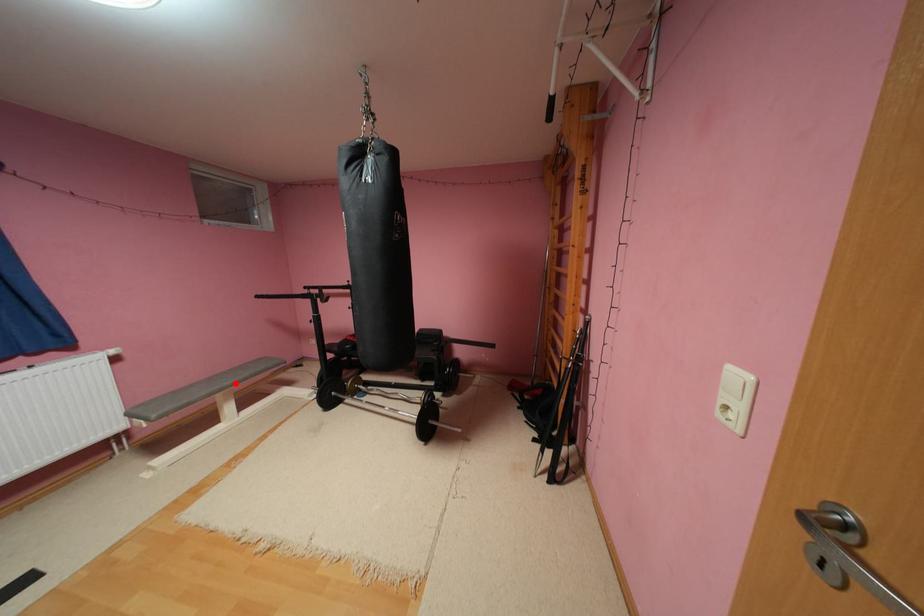
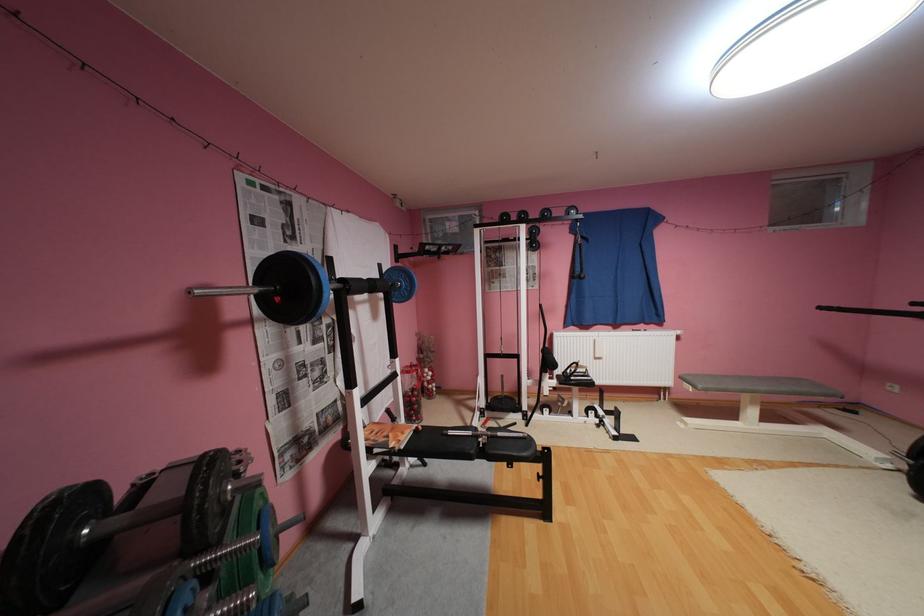
Question: I am providing you with two images of the same scene from different viewpoints. In image1, a red point is highlighted. Considering the same 3D point in image2, which of the following is correct?

Choices:
 (A) It is closer
 (B) It is farther

Answer: (B)